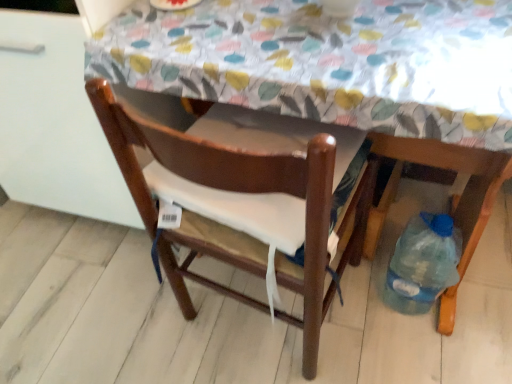
Identify the location of unoccupied area in front of translucent plastic bottle at lower right, which appears as the 2th chair when viewed from the left. The image size is (512, 384). (432, 349).